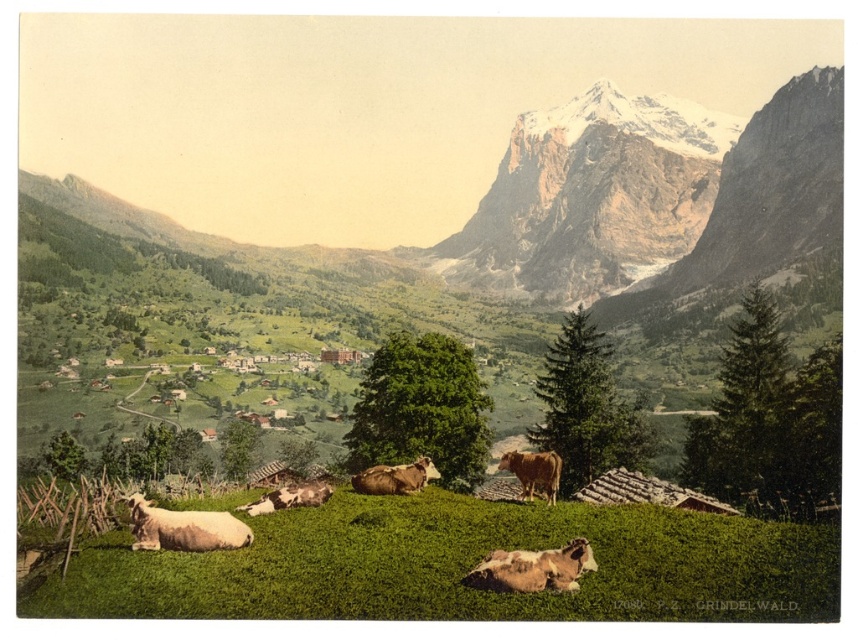
You are a hiker standing at the base of the snowy granite peak at upper center. You want to reach the summit. Given that the average hiker ascends 300 meters per hour, how long will it take you to reach the top?

The snowy granite peak at upper center and viewer are 438.31 meters apart. At an average ascent rate of 300 meters per hour, it would take approximately 1.46 hours, or roughly 1 hour and 28 minutes, to reach the summit.

You are an alpine hiker standing at the base of the snowy granite peak at upper center and looking towards the brown matte cow at center. Which object is closer to you?

The brown matte cow at center is behind the snowy granite peak at upper center, so the snowy granite peak at upper center is closer to you.

You are an alpine photographer standing in the meadow and want to capture both the brown speckled cow at lower center and the spotted fur cow at center in your photo. Which cow is positioned lower in the frame?

The brown speckled cow at lower center is positioned lower in the frame than the spotted fur cow at center.